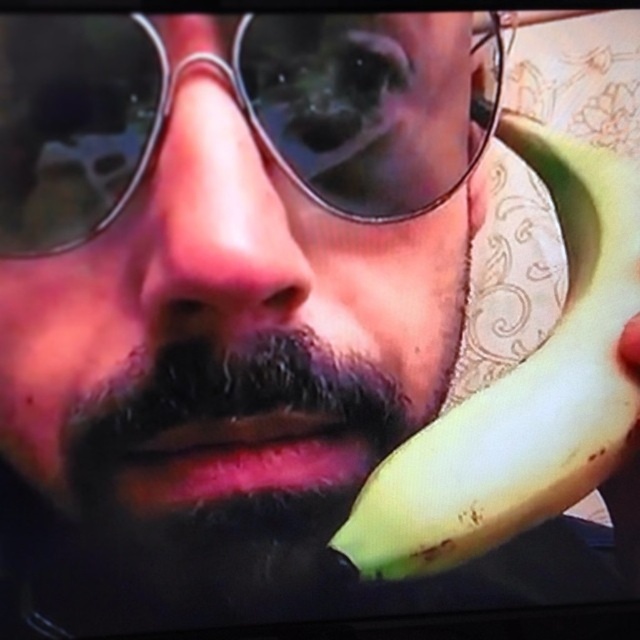
You are a photographer adjusting the lighting in a studio. You notice the metallic round sunglasses at center and the yellow matte banana at right in the scene. Which object should you move closer to the light source to ensure its details are better highlighted?

The yellow matte banana at right should be moved closer to the light source because the metallic round sunglasses at center is positioned on the left side of it, so moving the banana closer would ensure its details are better highlighted under the light.

You are a photographer trying to capture a closeup of the person in the scene. You need to ensure that both the matte black sunglasses at center and the yellow matte banana at right are clearly visible in the frame. Based on their positions, which object is closer to the left side of the photo?

The matte black sunglasses at center are to the left of the yellow matte banana at right, so the matte black sunglasses at center is closer to the left side of the photo.